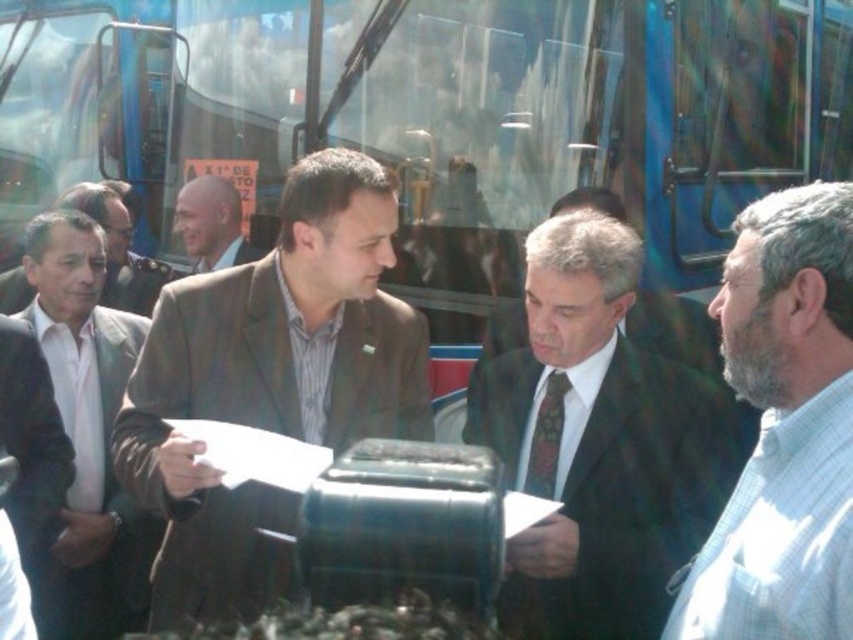
You are a photographer standing in front of the scene. You need to take a photo that includes both the white matte suit at left and the matte brown suit at left. Based on their positions, which one should be placed on the right side of the photo to ensure both are visible?

The white matte suit at left should be placed on the right side of the photo because it is already positioned to the right of the matte brown suit at left, allowing both to be captured in the frame without overlapping.

You are a photographer positioned at the center of the scene. You need to capture a photo that includes both the white checkered shirt at right and the white matte suit at left. What is the minimum distance you should set your camera lens to ensure both subjects are in frame?

The white checkered shirt at right is 2.27 meters from the white matte suit at left. To include both in the frame, the camera lens should be set to a focal length that can cover at least 2.27 meters, ensuring both subjects are within the field of view.

You are a photographer standing at the camera position. You want to take a closeup photo of the white checkered shirt at right. Considering its distance from the camera, is it possible to capture it clearly without moving the shirt or yourself?

The white checkered shirt at right is 4.62 feet away from the camera. Since this distance is manageable for a closeup shot with proper zoom, it is possible to capture it clearly without moving the shirt or yourself.